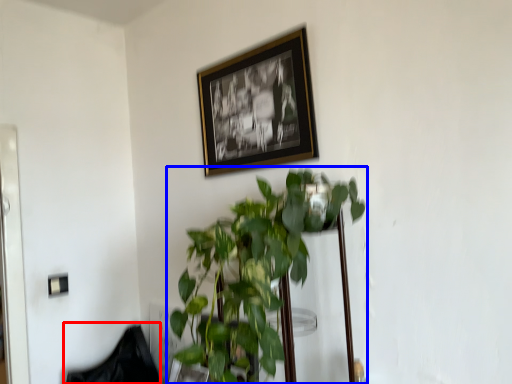
Question: Among these objects, which one is farthest to the camera, swivel chair (highlighted by a red box) or houseplant (highlighted by a blue box)?

Choices:
 (A) swivel chair
 (B) houseplant

Answer: (A)